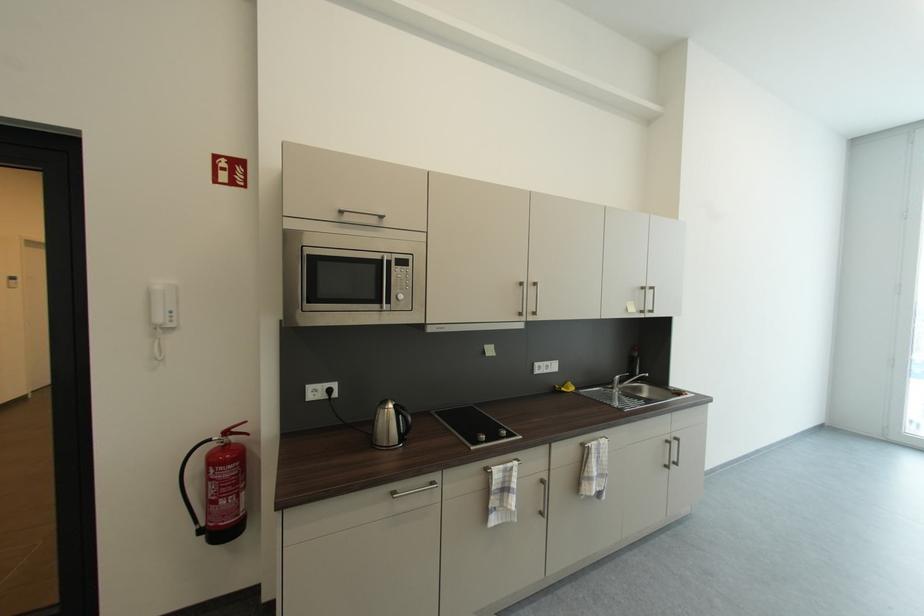
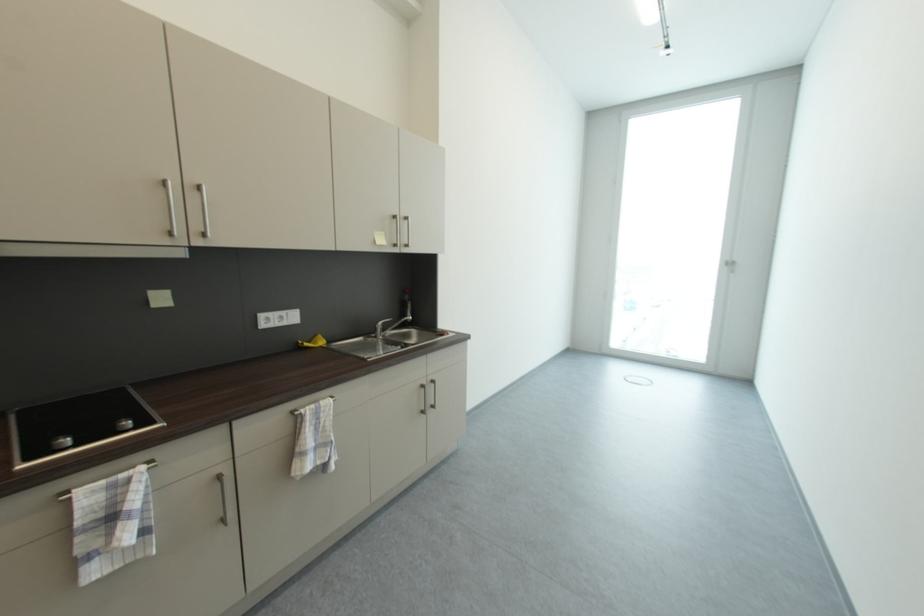
In a continuous first-person perspective shot, in which direction is the camera moving?

The movement direction of the cameraman is right, forward.